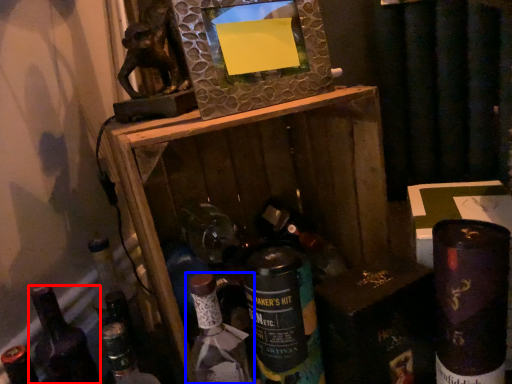
Question: Which point is further to the camera, bottle (highlighted by a red box) or bottle (highlighted by a blue box)?

Choices:
 (A) bottle
 (B) bottle

Answer: (A)